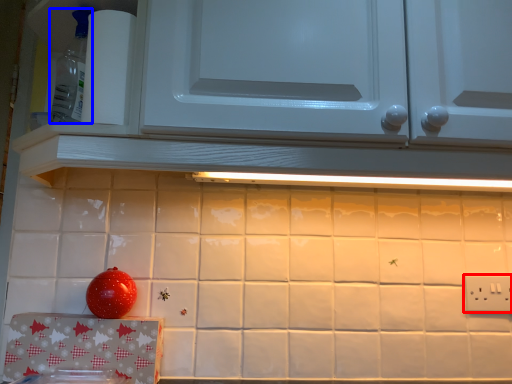
Question: Which object appears farthest to the camera in this image, electric outlet (highlighted by a red box) or appliance (highlighted by a blue box)?

Choices:
 (A) electric outlet
 (B) appliance

Answer: (A)